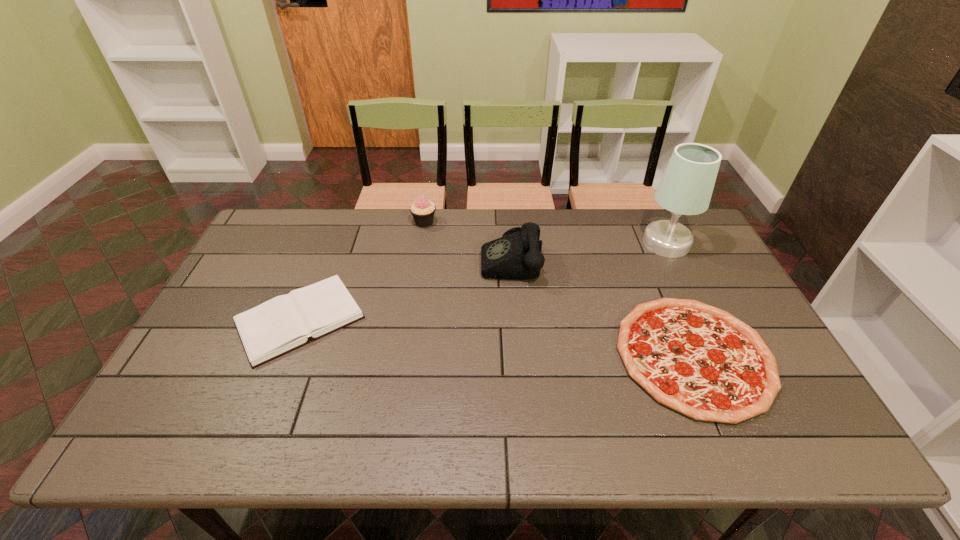
Find the location of a particular element. This screenshot has width=960, height=540. vacant space located 0.160m on the dial of the telephone is located at coordinates (431, 258).

I want to click on vacant space situated on the dial of the telephone, so click(x=420, y=258).

At what (x,y) coordinates should I click in order to perform the action: click on vacant space located 0.120m on the right of the cupcake. Please return your answer as a coordinate pair (x, y). Looking at the image, I should click on (470, 222).

Locate an element on the screen. free space located on the right of the leftmost object is located at coordinates (419, 320).

What are the coordinates of `vacant region located 0.170m on the back of the pizza` in the screenshot? It's located at (653, 263).

At what (x,y) coordinates should I click in order to perform the action: click on lampshade that is at the far edge. Please return your answer as a coordinate pair (x, y). The height and width of the screenshot is (540, 960). Looking at the image, I should click on (686, 187).

In order to click on telephone situated at the far edge in this screenshot , I will do `click(517, 255)`.

Find the location of a particular element. This screenshot has width=960, height=540. cupcake that is positioned at the far edge is located at coordinates (422, 210).

Locate an element on the screen. object present at the near edge is located at coordinates (699, 360).

The image size is (960, 540). Identify the location of object situated at the left edge. (278, 326).